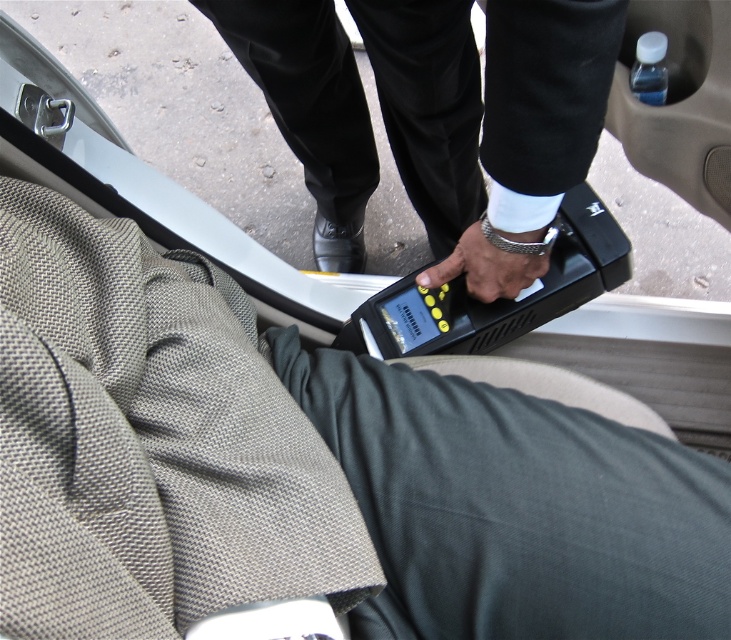
Question: Does black plastic remote at center have a greater width compared to satin silver wristwatch at center?

Choices:
 (A) yes
 (B) no

Answer: (A)

Question: Which point is farther from the camera taking this photo?

Choices:
 (A) (504, 236)
 (B) (491, 221)

Answer: (B)

Question: Does black plastic remote at center have a larger size compared to satin silver wristwatch at center?

Choices:
 (A) no
 (B) yes

Answer: (B)

Question: Does black plastic remote at center appear over satin silver wristwatch at center?

Choices:
 (A) yes
 (B) no

Answer: (A)

Question: Which of the following is the farthest from the observer?

Choices:
 (A) black plastic remote at center
 (B) satin silver wristwatch at center

Answer: (B)